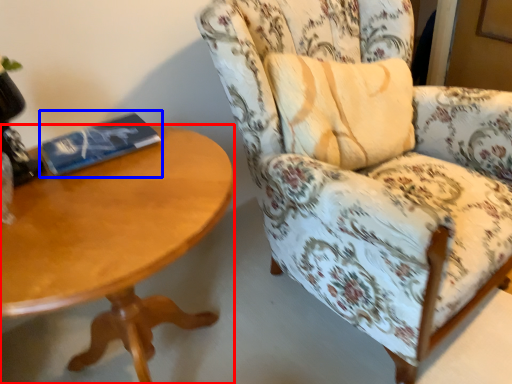
Question: Which point is closer to the camera, coffee table (highlighted by a red box) or paperback book (highlighted by a blue box)?

Choices:
 (A) coffee table
 (B) paperback book

Answer: (A)